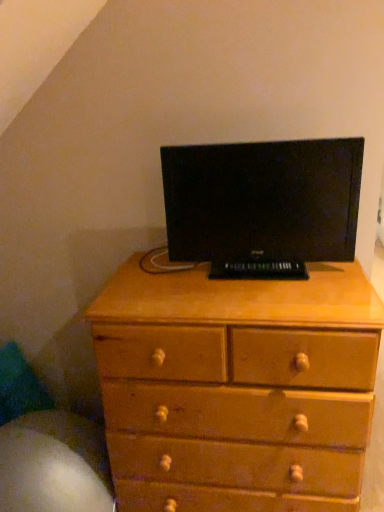
The image size is (384, 512). Find the location of `vacant space underneath black matte computer monitor at center (from a real-world perspective)`. vacant space underneath black matte computer monitor at center (from a real-world perspective) is located at coordinates (x=255, y=272).